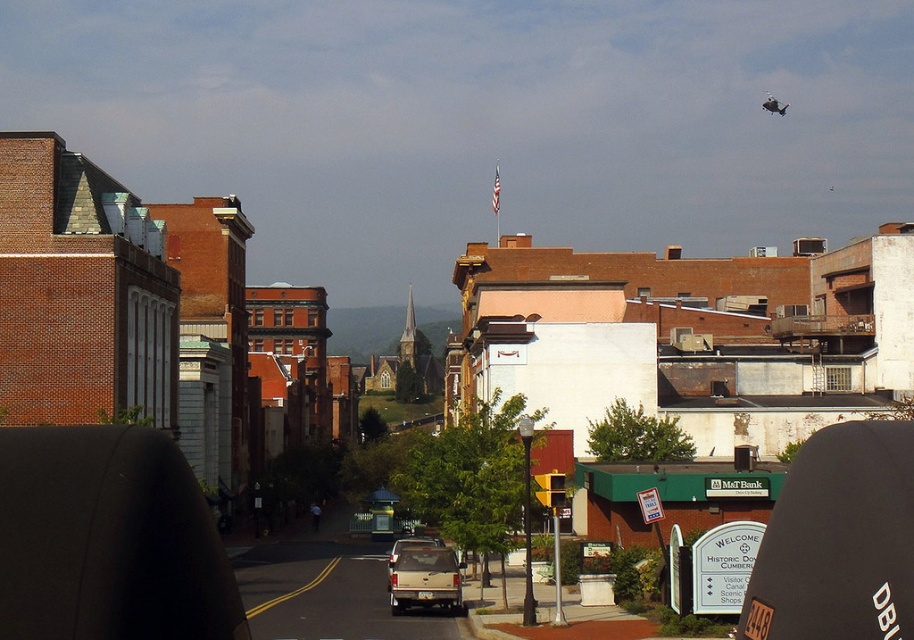
You are a pedestrian standing at the edge of the road. You see a beige matte truck at center and a matte white truck at center. Which truck is closer to the right side of the road?

The beige matte truck at center is closer to the right side of the road because it is positioned to the right of the matte white truck at center.

You are driving a car that is 5 feet long. You want to park between the beige matte truck at center and the matte white truck at center. Is there enough space between them to park your car?

The distance between the beige matte truck at center and the matte white truck at center is 6.15 feet. Since your car is 5 feet long, there is enough space to park between them.